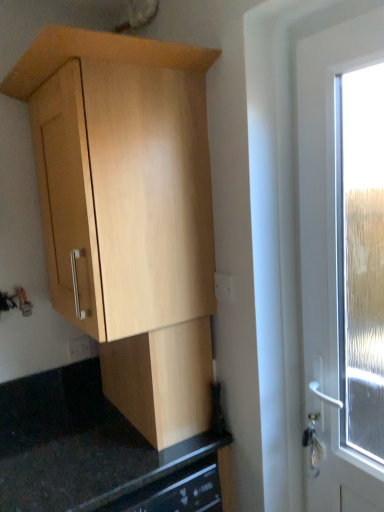
Question: Is white plastic electric outlet at center-right, positioned as the 1th electric outlet in front-to-back order, next to black granite countertop at lower center and touching it?

Choices:
 (A) no
 (B) yes

Answer: (A)

Question: Is the depth of white plastic electric outlet at center-right, positioned as the 1th electric outlet in front-to-back order, less than that of black granite countertop at lower center?

Choices:
 (A) no
 (B) yes

Answer: (A)

Question: Is white plastic electric outlet at center-right, positioned as the second electric outlet in bottom-to-top order, shorter than black granite countertop at lower center?

Choices:
 (A) yes
 (B) no

Answer: (A)

Question: Does white plastic electric outlet at center-right, positioned as the 1th electric outlet in front-to-back order, have a lesser width compared to black granite countertop at lower center?

Choices:
 (A) no
 (B) yes

Answer: (B)

Question: Choose the correct answer: Is light wood cabinet at upper left, which ranks as the 1th cabinetry in top-to-bottom order, inside white plastic electric outlet at center-right, arranged as the first electric outlet when viewed from the top, or outside it?

Choices:
 (A) inside
 (B) outside

Answer: (B)

Question: Is light wood cabinet at upper left, which ranks as the 1th cabinetry in top-to-bottom order, bigger or smaller than white plastic electric outlet at center-right, positioned as the 2th electric outlet in left-to-right order?

Choices:
 (A) small
 (B) big

Answer: (B)

Question: Considering the positions of point (114, 138) and point (230, 280), is point (114, 138) closer or farther from the camera than point (230, 280)?

Choices:
 (A) farther
 (B) closer

Answer: (B)

Question: In the image, is light wood cabinet at upper left, marked as the 2th cabinetry in a bottom-to-top arrangement, positioned in front of or behind white plastic electric outlet at center-right, arranged as the first electric outlet when viewed from the top?

Choices:
 (A) front
 (B) behind

Answer: (A)

Question: Based on their sizes in the image, would you say light wood cabinet at center, the second cabinetry positioned from the top, is bigger or smaller than white plastic electric outlet at lower left, which is counted as the second electric outlet, starting from the top?

Choices:
 (A) big
 (B) small

Answer: (A)

Question: From a real-world perspective, is light wood cabinet at center, placed as the first cabinetry when sorted from bottom to top, positioned above or below white plastic electric outlet at lower left, acting as the 2th electric outlet starting from the right?

Choices:
 (A) above
 (B) below

Answer: (B)

Question: In terms of height, does light wood cabinet at center, placed as the first cabinetry when sorted from bottom to top, look taller or shorter compared to white plastic electric outlet at lower left, which is counted as the second electric outlet, starting from the top?

Choices:
 (A) tall
 (B) short

Answer: (A)

Question: Is light wood cabinet at center, the second cabinetry positioned from the top, wider or thinner than white plastic electric outlet at lower left, the second electric outlet in the front-to-back sequence?

Choices:
 (A) wide
 (B) thin

Answer: (A)

Question: Relative to white plastic electric outlet at center-right, arranged as the first electric outlet when viewed from the top, is white plastic electric outlet at lower left, the second electric outlet in the front-to-back sequence, in front or behind?

Choices:
 (A) behind
 (B) front

Answer: (A)

Question: Is white plastic electric outlet at lower left, which ranks as the first electric outlet in bottom-to-top order, taller or shorter than white plastic electric outlet at center-right, the second electric outlet from the back?

Choices:
 (A) short
 (B) tall

Answer: (A)